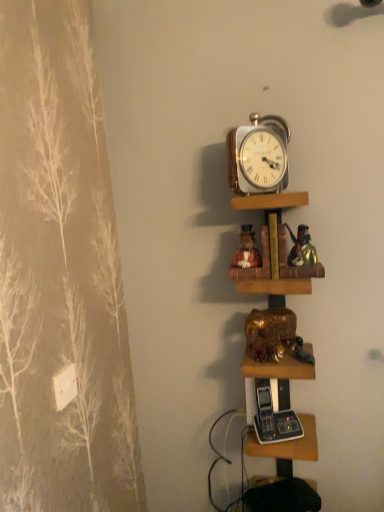
Question: Which is correct: gold metallic alarm clock at upper center is inside gold metallic elephant at center, or outside of it?

Choices:
 (A) inside
 (B) outside

Answer: (B)

Question: From their relative heights in the image, would you say gold metallic alarm clock at upper center is taller or shorter than gold metallic elephant at center?

Choices:
 (A) tall
 (B) short

Answer: (A)

Question: Estimate the real-world distances between objects in this image. Which object is closer to the gold metallic elephant at center?

Choices:
 (A) wooden shelves at center, positioned as the 1th shelf in bottom-to-top order
 (B) matte ceramic figurines at center, the 2th shelf from the bottom
 (C) gold metallic alarm clock at upper center

Answer: (A)

Question: Estimate the real-world distances between objects in this image. Which object is closer to the gold metallic elephant at center?

Choices:
 (A) gold metallic alarm clock at upper center
 (B) wooden shelves at center, positioned as the second shelf in top-to-bottom order
 (C) matte ceramic figurines at center, the 2th shelf from the bottom

Answer: (B)